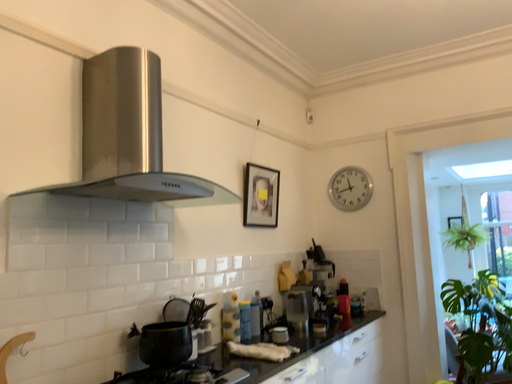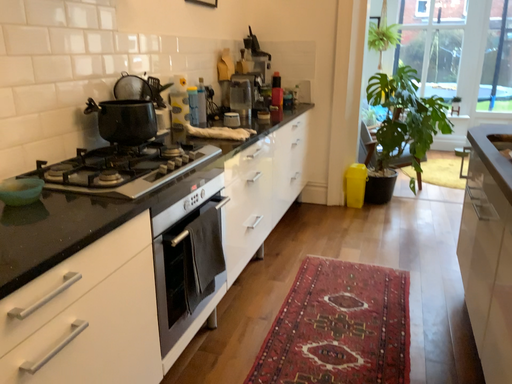
Question: How did the camera likely rotate when shooting the video?

Choices:
 (A) rotated downward
 (B) rotated upward

Answer: (A)